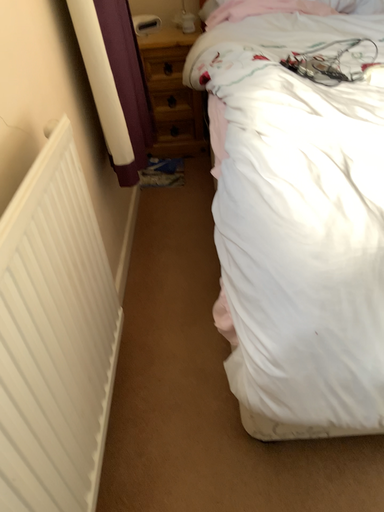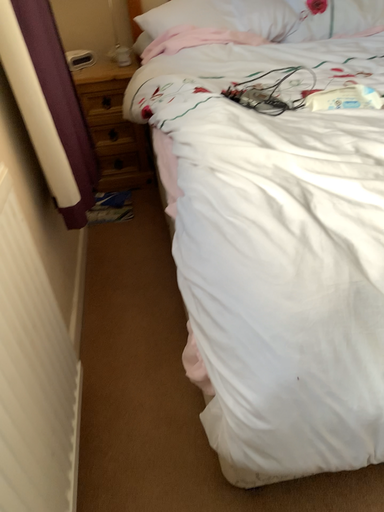
Question: Which way did the camera rotate in the video?

Choices:
 (A) rotated left
 (B) rotated right

Answer: (B)